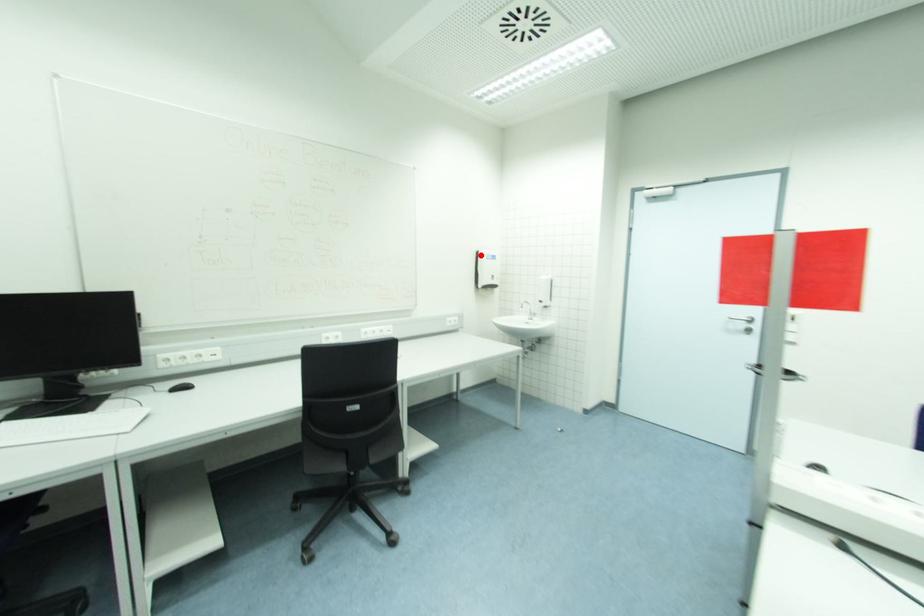
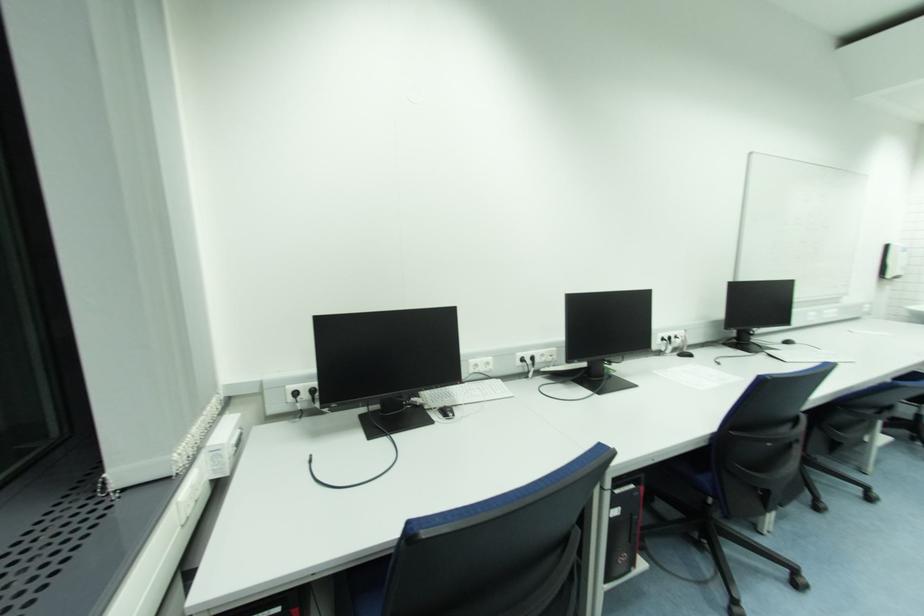
Question: A red point is marked in image1. In image2, is the corresponding 3D point closer to the camera or farther? Reply with the corresponding letter.

Choices:
 (A) The corresponding 3D point is closer.
 (B) The corresponding 3D point is farther.

Answer: (B)